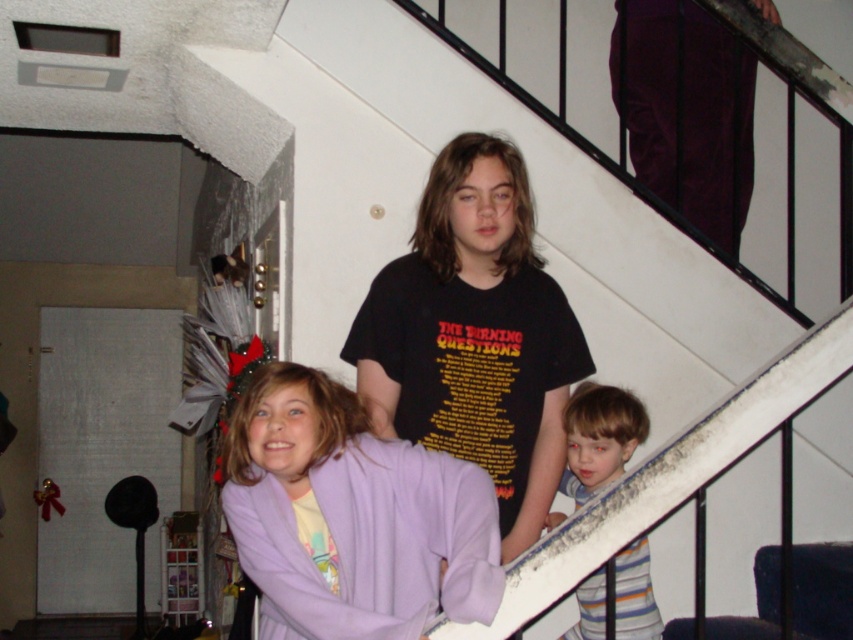
You are a painter who needs to paint the white matte stairwell at upper center and the striped cotton shirt at lower right. Which object requires more paint due to its size?

The white matte stairwell at upper center requires more paint because it has a larger size compared to the striped cotton shirt at lower right.

You are standing at the bottom of the staircase and want to reach the white matte stairwell at upper center. According to the coordinates provided, where should you look to find it?

The white matte stairwell at upper center is located at point 0.342 on the x axis and 0.631 on the y axis.

You are a delivery person carrying a box that is 10 feet long. You need to navigate through the white matte stairwell at upper center. Based on the information provided, can you safely pass through the stairwell without the box getting stuck?

The white matte stairwell at upper center is 9.44 feet away from the camera. However, the question is about the dimensions of the stairwell, not its distance. Since the provided information only mentions the distance and not the dimensions or height of the stairwell, it is impossible to determine if the 10 feet long box can pass through safely. Additional measurements like the stairwell height or width are needed to make this assessment.